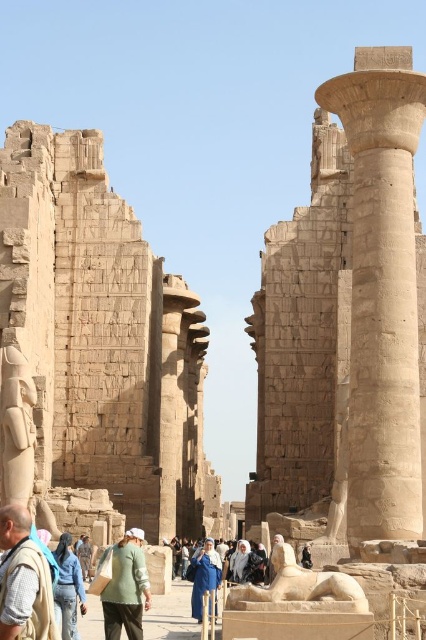
Question: Among these objects, which one is farthest from the camera?

Choices:
 (A) blue denim jeans at lower left
 (B) beige stone wall at center
 (C) beige stone column at right

Answer: (A)

Question: Is green cotton shirt at center thinner than blue denim jeans at lower left?

Choices:
 (A) yes
 (B) no

Answer: (B)

Question: Is blue fabric headscarf at center further to the viewer compared to blue denim jeans at lower left?

Choices:
 (A) yes
 (B) no

Answer: (B)

Question: Which point is farther to the camera?

Choices:
 (A) beige stone column at right
 (B) denim jeans at lower left
 (C) beige stone wall at center

Answer: (C)

Question: Which point is closer to the camera?

Choices:
 (A) blue fabric headscarf at center
 (B) sandstone statue at center
 (C) blue denim jeans at lower left

Answer: (B)

Question: Considering the relative positions of beige fabric backpack at lower left and blue denim jeans at lower left in the image provided, where is beige fabric backpack at lower left located with respect to blue denim jeans at lower left?

Choices:
 (A) below
 (B) above

Answer: (B)